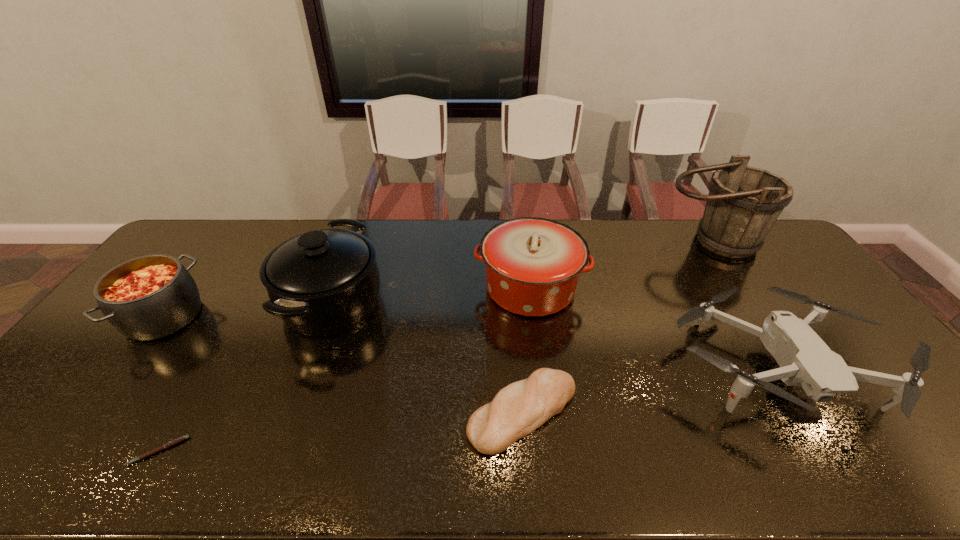
You are a GUI agent. You are given a task and a screenshot of the screen. Output one action in this format:
    pyautogui.click(x=<x>, y=<y>)
    Task: Click on the pen
    
    Given the screenshot: What is the action you would take?
    pyautogui.click(x=180, y=439)

I want to click on vacant region located 0.310m on the handle side of the bucket, so click(x=769, y=331).

Find the location of a particular element. free spot located 0.050m on the right of the saucepan is located at coordinates (399, 302).

Locate an element on the screen. free space located on the right of the right casserole is located at coordinates (617, 288).

In order to click on vacant point located on the right of the left casserole in this screenshot , I will do `click(249, 316)`.

Find the location of `vacant region located with a camera at the front of the drone`. vacant region located with a camera at the front of the drone is located at coordinates (844, 476).

Locate an element on the screen. blank space located on the back of the second shortest object is located at coordinates (516, 320).

This screenshot has height=540, width=960. Find the location of `bucket situated at the far edge`. bucket situated at the far edge is located at coordinates (743, 204).

In order to click on saucepan that is at the far edge in this screenshot , I will do `click(324, 282)`.

You are a GUI agent. You are given a task and a screenshot of the screen. Output one action in this format:
    pyautogui.click(x=<x>, y=<y>)
    Task: Click on the casserole positioned at the far edge
    This screenshot has height=540, width=960.
    Given the screenshot: What is the action you would take?
    pyautogui.click(x=533, y=264)